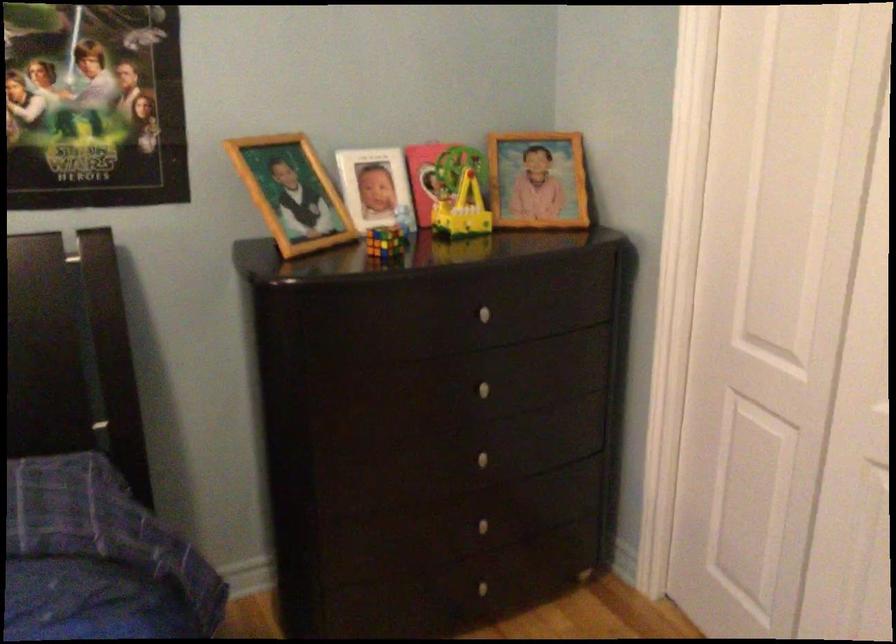
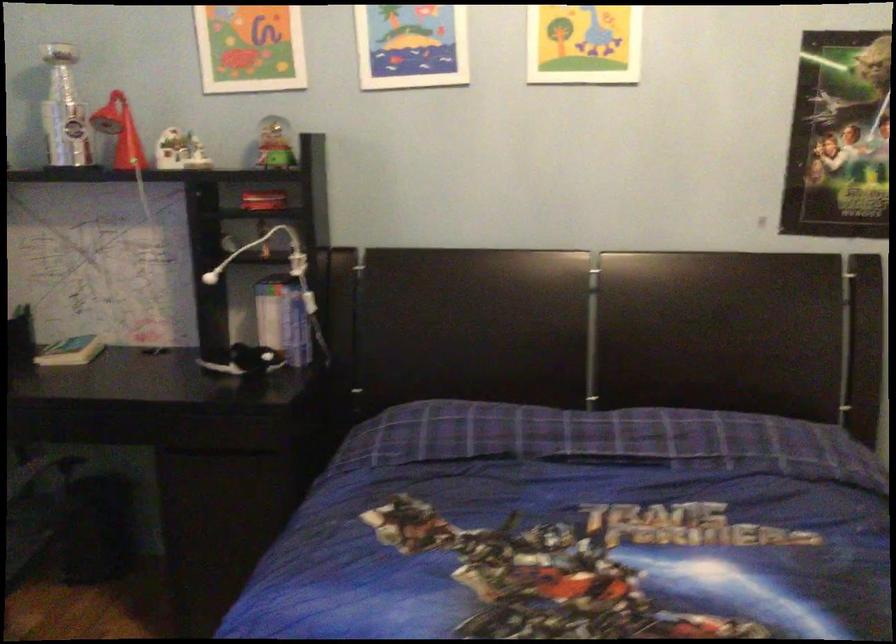
Question: The camera is either moving clockwise (left) or counter-clockwise (right) around the object. The first image is from the beginning of the video and the second image is from the end. Is the camera moving left or right when shooting the video?

Choices:
 (A) Left
 (B) Right

Answer: (B)